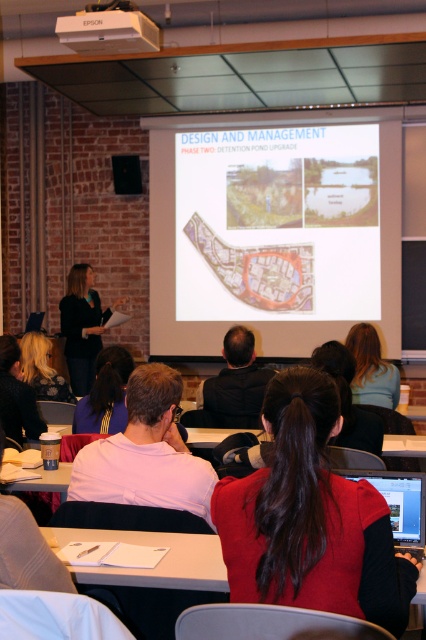
Question: Which point is closer to the camera taking this photo?

Choices:
 (A) (0, 506)
 (B) (370, 476)

Answer: (A)

Question: Does pink fabric shirt at center have a larger size compared to black fabric at left?

Choices:
 (A) no
 (B) yes

Answer: (A)

Question: Among these objects, which one is farthest from the camera?

Choices:
 (A) black fabric at left
 (B) pink fabric shirt at center
 (C) matte black speaker at upper left

Answer: (C)

Question: Among these objects, which one is farthest from the camera?

Choices:
 (A) blonde hair at upper center
 (B) blonde hair at upper left

Answer: (A)

Question: Is blonde hair at lower left positioned at the back of white paper at lower left?

Choices:
 (A) yes
 (B) no

Answer: (A)

Question: Does black fabric at left appear over purple fabric at center?

Choices:
 (A) yes
 (B) no

Answer: (A)